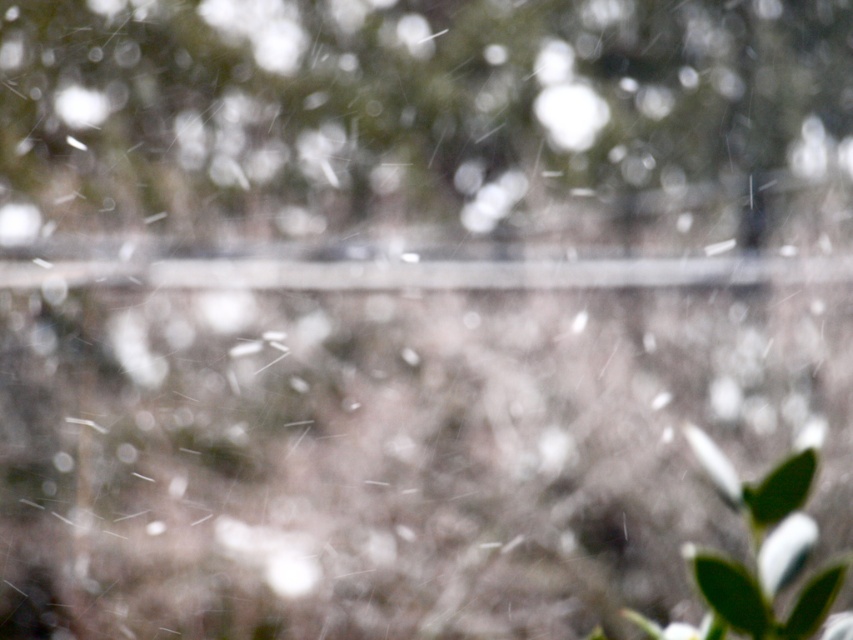
Who is lower down, green leafy tree at center or green matte leaf at lower right?

green matte leaf at lower right

Can you confirm if green leafy tree at center is shorter than green matte leaf at lower right?

Incorrect, green leafy tree at center's height does not fall short of green matte leaf at lower right's.

Does point (119, 108) come in front of point (746, 586)?

That is False.

Locate an element on the screen. This screenshot has height=640, width=853. green leafy tree at center is located at coordinates 403,104.